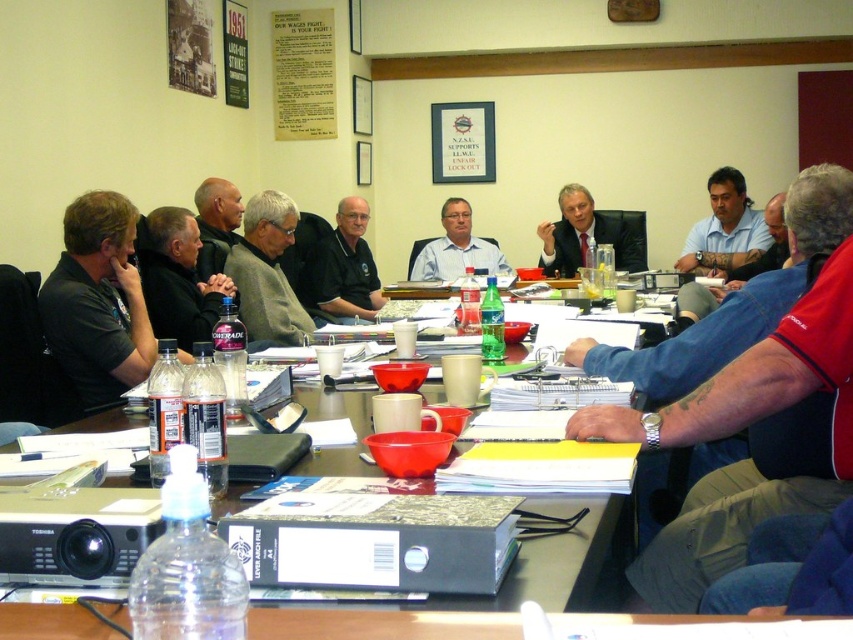
Question: Estimate the real-world distances between objects in this image. Which object is closer to the matte black shirt at left?

Choices:
 (A) matte blue shirt at center
 (B) black matte shirt at left
 (C) matte plastic table at center
 (D) gray sweater at center

Answer: (B)

Question: Which object is farther from the camera taking this photo?

Choices:
 (A) black matte shirt at left
 (B) matte plastic table at center
 (C) paper poster at upper center

Answer: (C)

Question: Among these points, which one is nearest to the camera?

Choices:
 (A) (488, 257)
 (B) (579, 252)

Answer: (B)

Question: Considering the relative positions of matte black shirt at left and black matte shirt at left in the image provided, where is matte black shirt at left located with respect to black matte shirt at left?

Choices:
 (A) below
 (B) above

Answer: (A)

Question: From the image, what is the correct spatial relationship of paper poster at upper center in relation to black shirt at center?

Choices:
 (A) above
 (B) below

Answer: (A)

Question: Does matte black shirt at left appear on the right side of matte black suit at center?

Choices:
 (A) yes
 (B) no

Answer: (B)